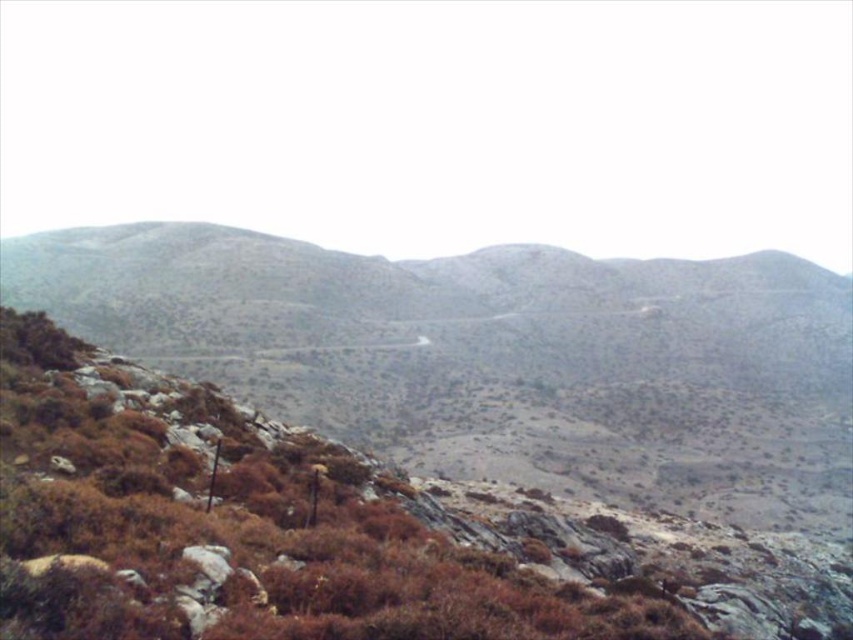
You are a hiker planning to take a photo of the brown rocky mountain at lower left and the brown shrubbery at center. Which object should you position to your left side to frame both in the shot?

To frame both the brown rocky mountain at lower left and the brown shrubbery at center in your photo, position the brown shrubbery at center to your left side since the brown rocky mountain at lower left is located to the right of it.

You are a hiker trying to navigate through the rugged mountain terrain. You see the brown rocky mountain at lower left and the brown shrubbery at center. Which object is closer to you as you stand at the starting point?

The brown rocky mountain at lower left is closer to you because the brown shrubbery at center is positioned behind it.

You are a hiker planning to cross the valley between the brown rocky mountain at lower left and the brown shrubbery at center. Which object will you encounter first as you move towards the center of the valley?

The brown shrubbery at center will be encountered first since it is closer to the center of the valley than the brown rocky mountain at lower left.